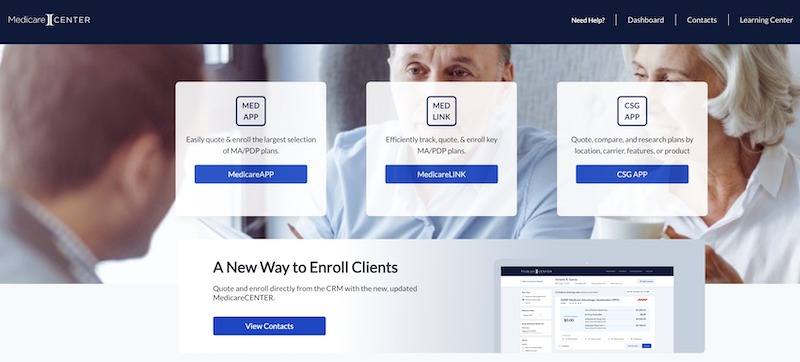
You are a GUI agent. You are given a task and a screenshot of the screen. Output one action in this format:
    pyautogui.click(x=<x>, y=<y>)
    Task: Click on the mug
    This screenshot has width=800, height=362.
    Given the screenshot: What is the action you would take?
    pyautogui.click(x=626, y=228)